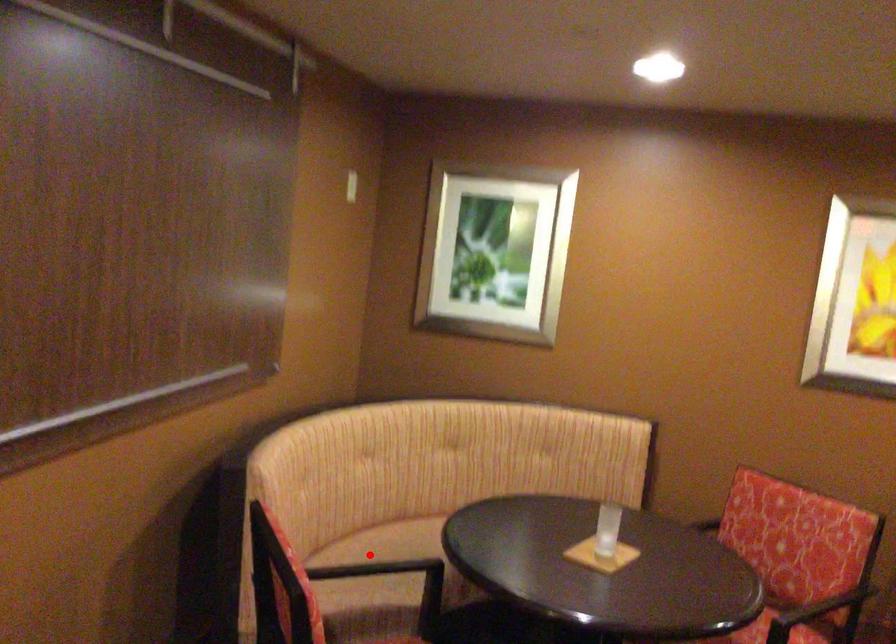
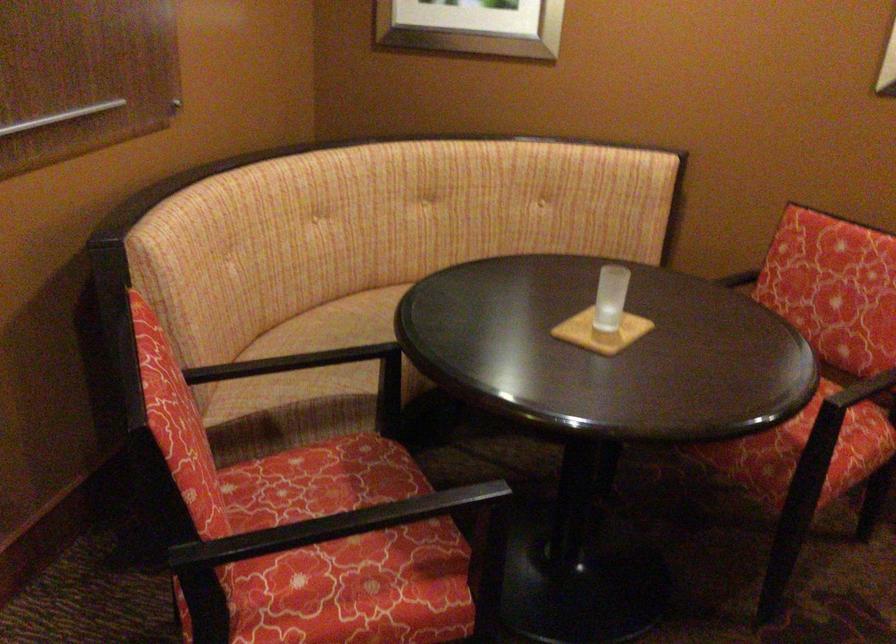
Question: I am providing you with two images of the same scene from different viewpoints. In image1, a red point is highlighted. Considering the same 3D point in image2, which of the following is correct?

Choices:
 (A) It is closer
 (B) It is farther

Answer: (A)